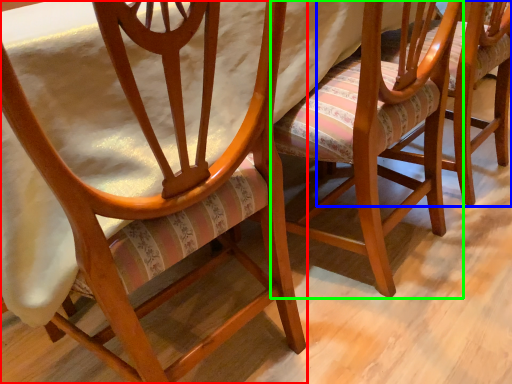
Question: Considering the real-world distances, which object is farthest from chair (highlighted by a red box)? chair (highlighted by a blue box) or chair (highlighted by a green box)?

Choices:
 (A) chair
 (B) chair

Answer: (A)